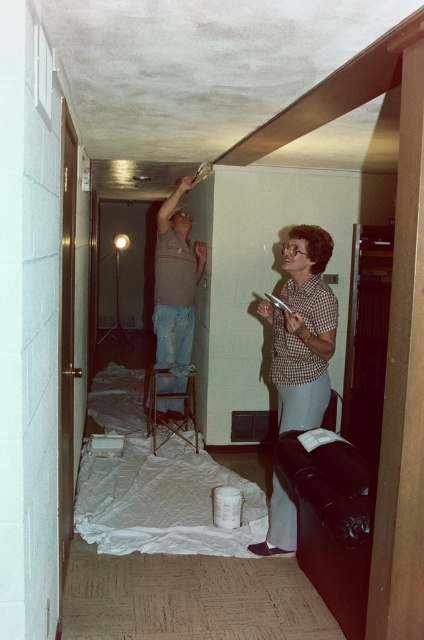
You are a home inspector assessing the safety of the current setup. The person is standing on a small folding stool while working on the ceiling. Considering the position of the checkered fabric blouse at center, which is located at point (x=303, y=330), is there a risk of the stool tipping over? Please explain your reasoning based on the scene description.

The checkered fabric blouse at center is located at point (x=303, y=330), which is the center of the image. Since the stool is positioned on a large sheet of plastic at the center, the weight distribution might be uneven if the person leans too far backward while reaching the ceiling. This could increase the risk of the stool tipping over. Additionally, the low ceiling might limit their movement, further compromising stability.

You are a painter assessing the workspace in the image. You need to determine if the checkered fabric blouse at center and the matte brown shirt at upper center are positioned in a way that could interfere with the painting activity. Based on their spatial relationship, which one is closer to the paint can?

The checkered fabric blouse at center is in front of the matte brown shirt at upper center, so the checkered fabric blouse at center is closer to the paint can.

You are a contractor working in the room and need to locate the matte brown shirt at upper center. Where exactly is it located?

The matte brown shirt at upper center is located at point (175, 282).